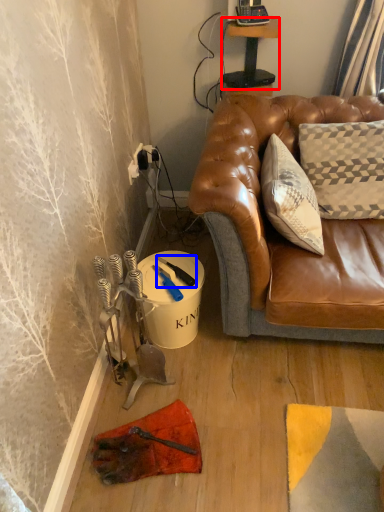
Question: Which of the following is the closest to the observer, table (highlighted by a red box) or tool (highlighted by a blue box)?

Choices:
 (A) table
 (B) tool

Answer: (B)